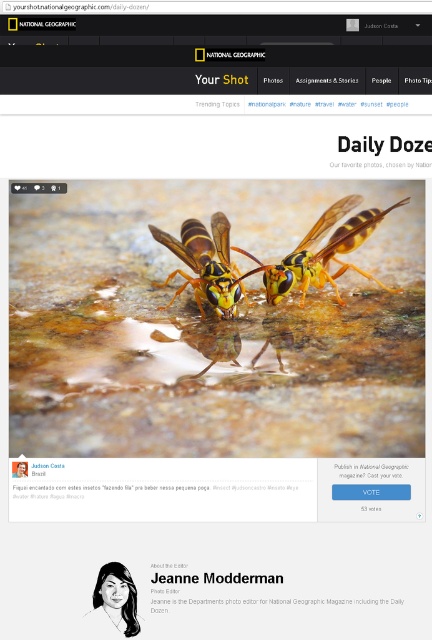
You are a photographer reviewing submissions for National Geographic. You see the image titled Daily Dozen with a yellow striped wasp at center and black paper text at center. Which object is positioned higher in the image?

The yellow striped wasp at center is positioned higher than the black paper text at center in the image.

From the picture: You are an entomologist examining the image of two wasps drinking water from a puddle. Based on their size, which wasp is more likely to be the dominant one between the yellow matte wasp at center and the yellow striped wasp at center?

The yellow matte wasp at center is larger in size than the yellow striped wasp at center, so it is more likely to be the dominant one.

You are a photographer reviewing submissions for National Geographic. You need to determine if the wasp in the image is centered. The image has a coordinate system where the bottom left corner is the origin. The wasp is labeled as yellow matte wasp at center. Is the point at coordinate point (320, 252) the center of the image?

The point (320, 252) corresponds to the yellow matte wasp at center, so yes, this point is the center of the image.